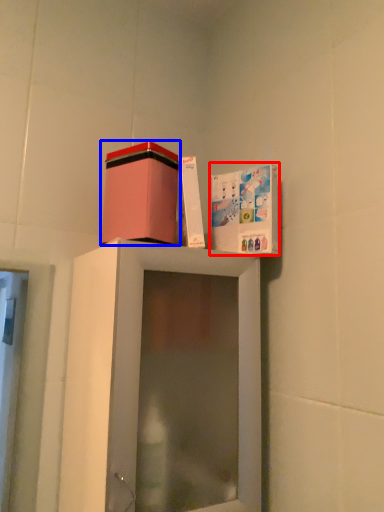
Question: Which object is closer to the camera taking this photo, cabinet (highlighted by a red box) or cardboard box (highlighted by a blue box)?

Choices:
 (A) cabinet
 (B) cardboard box

Answer: (B)